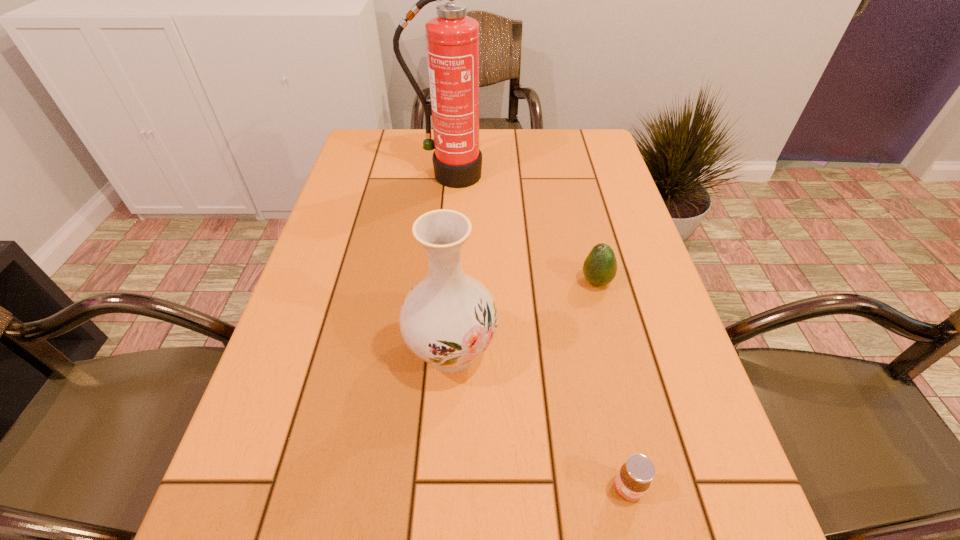
This screenshot has width=960, height=540. What are the coordinates of `free spot that satisfies the following two spatial constraints: 1. on the back side of the third farthest object; 2. on the right side of the third nearest object` in the screenshot? It's located at (455, 282).

You are a GUI agent. You are given a task and a screenshot of the screen. Output one action in this format:
    pyautogui.click(x=<x>, y=<y>)
    Task: Click on the blank space that satisfies the following two spatial constraints: 1. on the front-facing side of the tallest object; 2. on the left side of the third shortest object
    The height and width of the screenshot is (540, 960).
    Given the screenshot: What is the action you would take?
    pyautogui.click(x=434, y=352)

You are a GUI agent. You are given a task and a screenshot of the screen. Output one action in this format:
    pyautogui.click(x=<x>, y=<y>)
    Task: Click on the blank space that satisfies the following two spatial constraints: 1. on the front-facing side of the tallest object; 2. on the left side of the vase
    This screenshot has height=540, width=960.
    Given the screenshot: What is the action you would take?
    pyautogui.click(x=434, y=352)